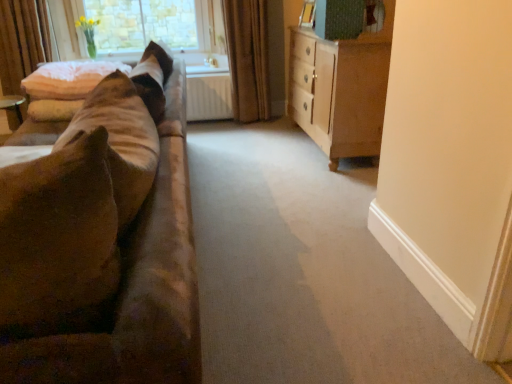
Question: Does white fluffy pillow at upper left have a smaller size compared to brown textured curtain at center?

Choices:
 (A) no
 (B) yes

Answer: (B)

Question: Considering the relative sizes of white fluffy pillow at upper left and brown textured curtain at center in the image provided, is white fluffy pillow at upper left taller than brown textured curtain at center?

Choices:
 (A) yes
 (B) no

Answer: (B)

Question: Is brown textured curtain at center completely or partially inside white fluffy pillow at upper left?

Choices:
 (A) yes
 (B) no

Answer: (B)

Question: From the image's perspective, is white fluffy pillow at upper left on brown textured curtain at center?

Choices:
 (A) no
 (B) yes

Answer: (A)

Question: Is white fluffy pillow at upper left shorter than brown textured curtain at center?

Choices:
 (A) no
 (B) yes

Answer: (B)

Question: From the image's perspective, is white fluffy pillow at upper left under brown textured curtain at center?

Choices:
 (A) yes
 (B) no

Answer: (A)

Question: Considering the relative sizes of light brown wood dresser at right and clear glass window at upper left in the image provided, is light brown wood dresser at right thinner than clear glass window at upper left?

Choices:
 (A) yes
 (B) no

Answer: (B)

Question: From the image's perspective, is light brown wood dresser at right above clear glass window at upper left?

Choices:
 (A) no
 (B) yes

Answer: (A)

Question: From a real-world perspective, is light brown wood dresser at right below clear glass window at upper left?

Choices:
 (A) yes
 (B) no

Answer: (A)

Question: Can you confirm if light brown wood dresser at right is wider than clear glass window at upper left?

Choices:
 (A) yes
 (B) no

Answer: (A)

Question: Does light brown wood dresser at right have a greater height compared to clear glass window at upper left?

Choices:
 (A) yes
 (B) no

Answer: (A)

Question: Is light brown wood dresser at right to the left of clear glass window at upper left from the viewer's perspective?

Choices:
 (A) yes
 (B) no

Answer: (B)

Question: Would you say suede-like brown couch at left is outside light brown wood dresser at right?

Choices:
 (A) no
 (B) yes

Answer: (B)